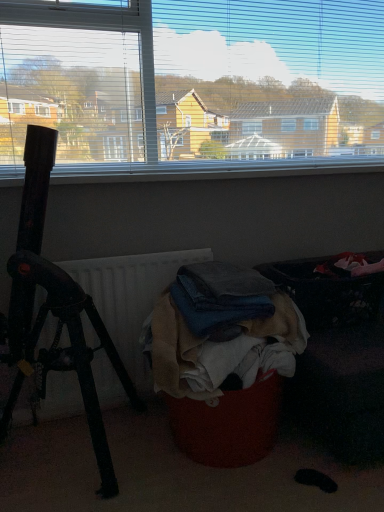
Question: Is the depth of textured fabric laundry basket at lower right less than that of denim fabric clothes at center?

Choices:
 (A) yes
 (B) no

Answer: (A)

Question: From a real-world perspective, does textured fabric laundry basket at lower right sit lower than denim fabric clothes at center?

Choices:
 (A) no
 (B) yes

Answer: (B)

Question: From a real-world perspective, is textured fabric laundry basket at lower right on top of denim fabric clothes at center?

Choices:
 (A) no
 (B) yes

Answer: (A)

Question: Considering the relative positions of textured fabric laundry basket at lower right and denim fabric clothes at center in the image provided, is textured fabric laundry basket at lower right to the left of denim fabric clothes at center from the viewer's perspective?

Choices:
 (A) no
 (B) yes

Answer: (A)

Question: Is denim fabric clothes at center located within textured fabric laundry basket at lower right?

Choices:
 (A) yes
 (B) no

Answer: (B)

Question: Is denim fabric clothes at center wider or thinner than white matte radiator at center?

Choices:
 (A) thin
 (B) wide

Answer: (B)

Question: Based on their sizes in the image, would you say denim fabric clothes at center is bigger or smaller than white matte radiator at center?

Choices:
 (A) big
 (B) small

Answer: (A)

Question: In terms of height, does denim fabric clothes at center look taller or shorter compared to white matte radiator at center?

Choices:
 (A) short
 (B) tall

Answer: (A)

Question: From a real-world perspective, is denim fabric clothes at center above or below white matte radiator at center?

Choices:
 (A) above
 (B) below

Answer: (A)

Question: Would you say denim fabric clothes at center is inside or outside dark fabric laundry basket at right?

Choices:
 (A) inside
 (B) outside

Answer: (B)

Question: From the image's perspective, is denim fabric clothes at center positioned above or below dark fabric laundry basket at right?

Choices:
 (A) above
 (B) below

Answer: (B)

Question: From their relative heights in the image, would you say denim fabric clothes at center is taller or shorter than dark fabric laundry basket at right?

Choices:
 (A) short
 (B) tall

Answer: (B)

Question: Based on their positions, is denim fabric clothes at center located to the left or right of dark fabric laundry basket at right?

Choices:
 (A) right
 (B) left

Answer: (B)

Question: Considering the relative positions of black matte tripod at left and denim fabric clothes at center in the image provided, is black matte tripod at left to the left or to the right of denim fabric clothes at center?

Choices:
 (A) left
 (B) right

Answer: (A)

Question: In terms of width, does black matte tripod at left look wider or thinner when compared to denim fabric clothes at center?

Choices:
 (A) thin
 (B) wide

Answer: (B)